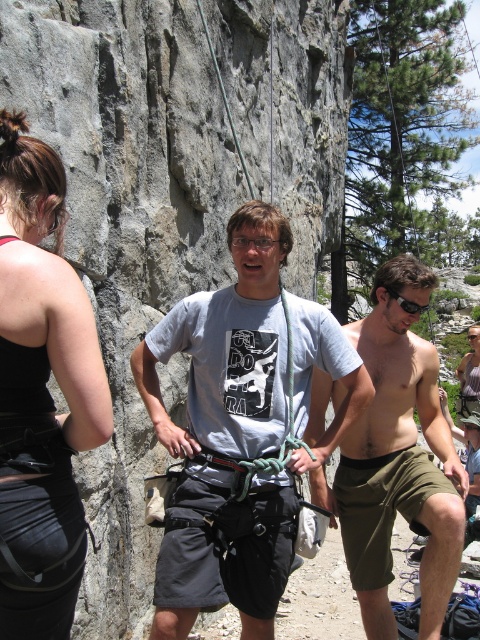
The width and height of the screenshot is (480, 640). What do you see at coordinates (127, 228) in the screenshot? I see `gray rock cliff at center` at bounding box center [127, 228].

Does gray rock cliff at center have a greater height compared to gray fabric shirt at center?

Yes.

Is point (182, 257) closer to viewer compared to point (242, 330)?

No, (182, 257) is further to viewer.

Locate an element on the screen. This screenshot has height=640, width=480. gray rock cliff at center is located at coordinates (127, 228).

Who is positioned more to the right, black fabric harness at left or shiny metallic shorts at center?

shiny metallic shorts at center is more to the right.

Between black fabric harness at left and shiny metallic shorts at center, which one is positioned lower?

shiny metallic shorts at center

Between point (33, 362) and point (321, 477), which one is positioned behind?

The point (321, 477) is behind.

Locate an element on the screen. black fabric harness at left is located at coordinates (41, 394).

Measure the distance from gray fabric shirt at center to shiny metallic shorts at center.

The distance of gray fabric shirt at center from shiny metallic shorts at center is 2.75 meters.

Locate an element on the screen. Image resolution: width=480 pixels, height=640 pixels. gray fabric shirt at center is located at coordinates (240, 428).

You are a GUI agent. You are given a task and a screenshot of the screen. Output one action in this format:
    pyautogui.click(x=<x>, y=<y>)
    Task: Click on the gray fabric shirt at center
    
    Given the screenshot: What is the action you would take?
    pyautogui.click(x=240, y=428)